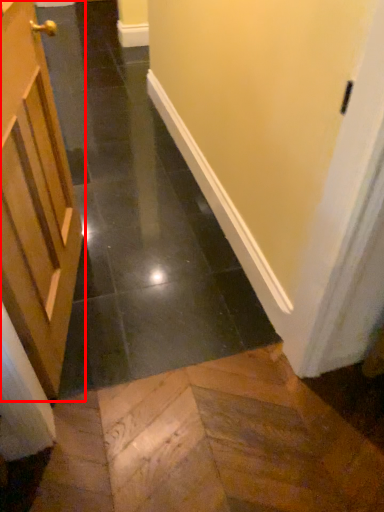
Question: Considering the relative positions of door (annotated by the red box) and path in the image provided, where is door (annotated by the red box) located with respect to the staircase?

Choices:
 (A) right
 (B) left

Answer: (B)